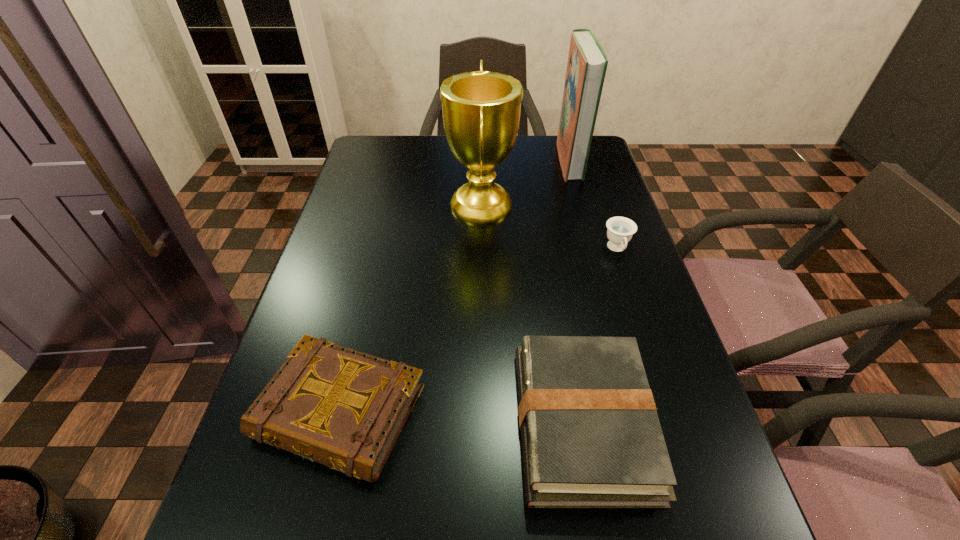
Find the location of a particular element. vacant area in the image that satisfies the following two spatial constraints: 1. on the side of the teacup with the handle; 2. on the spine side of the second tallest hardback book is located at coordinates (675, 423).

I want to click on vacant point that satisfies the following two spatial constraints: 1. on the shiny surface of the award; 2. on the front side of the leftmost object, so click(x=482, y=412).